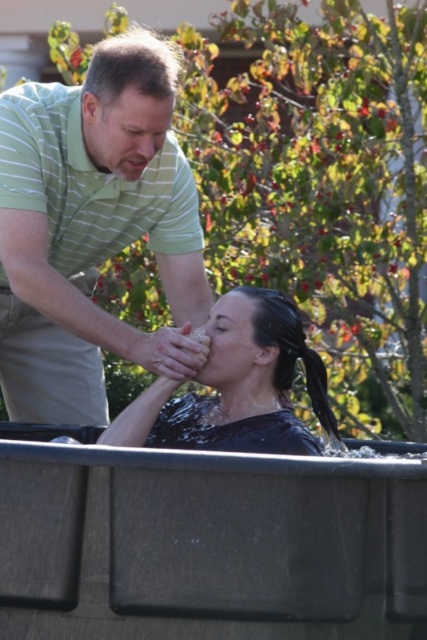
You are standing at the baptism site and want to know how far the point marked at coordinates (222, 362) is from your current position. Based on the scene, can you determine the distance?

The point marked at coordinates (222, 362) is 12.13 meters away from the viewer.

Based on the scene description, can you determine which object is positioned higher in the image between the wet hair at center and the smooth skin forehead at upper center?

The smooth skin forehead at upper center is positioned higher than the wet hair at center.

You are a photographer trying to capture the baptism scene. You need to ensure that both the green striped shirt at upper left and the smooth skin hand at upper center are in focus. Given that your camera can only focus on objects within a 2 meter range, will both be in focus?

The green striped shirt at upper left is 2.30 meters from smooth skin hand at upper center. Since the distance between them exceeds the camera focus range of 2 meters, both cannot be in focus simultaneously.